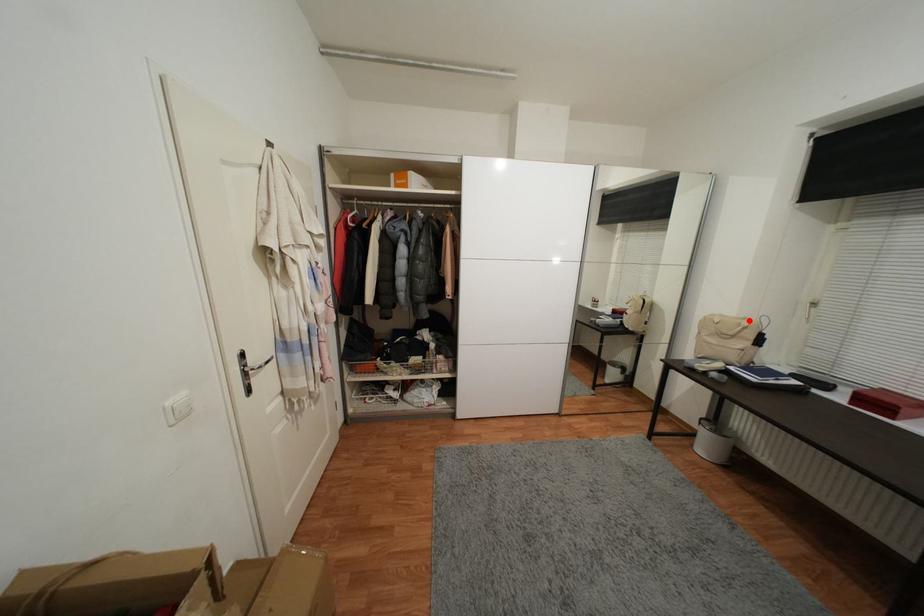
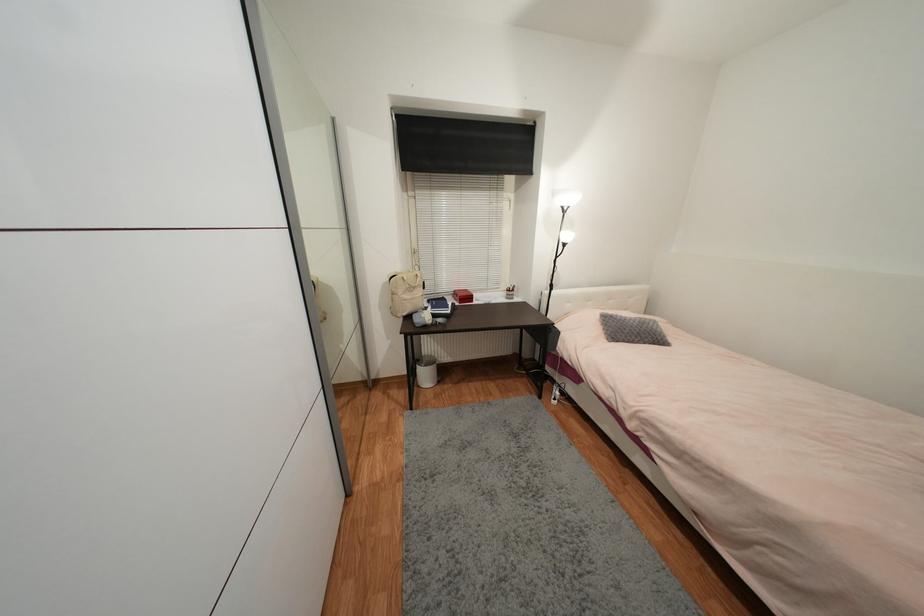
The point at the highlighted location is marked in the first image. Where is the corresponding point in the second image?

(412, 273)